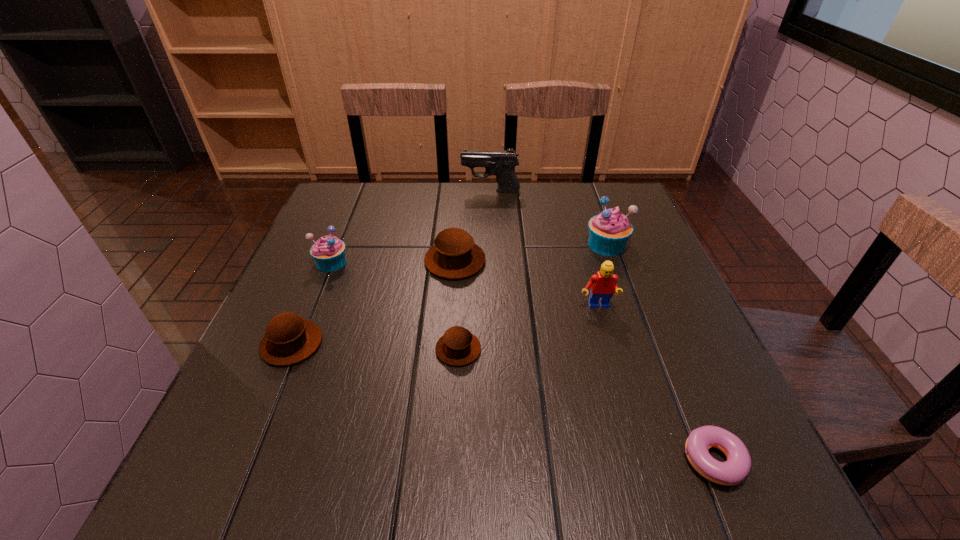
You are a GUI agent. You are given a task and a screenshot of the screen. Output one action in this format:
    pyautogui.click(x=<x>, y=<y>)
    Task: Click on the smallest brown muffin
    
    Given the screenshot: What is the action you would take?
    pyautogui.click(x=458, y=346)

Locate an element on the screen. The width and height of the screenshot is (960, 540). the shortest muffin is located at coordinates (458, 346).

At what (x,y) coordinates should I click in order to perform the action: click on doughnut. Please return your answer as a coordinate pair (x, y). Looking at the image, I should click on (731, 472).

The image size is (960, 540). I want to click on the shortest object, so click(731, 472).

Locate an element on the screen. free space located 0.240m at the barrel of the black pistol is located at coordinates (382, 191).

Where is `free space located 0.250m at the barrel of the black pistol`? The width and height of the screenshot is (960, 540). free space located 0.250m at the barrel of the black pistol is located at coordinates (379, 191).

Where is `free space located 0.250m at the barrel of the black pistol`? The height and width of the screenshot is (540, 960). free space located 0.250m at the barrel of the black pistol is located at coordinates (379, 191).

The image size is (960, 540). What are the coordinates of `vacant space located 0.110m on the left of the right blue muffin` in the screenshot? It's located at (542, 245).

The width and height of the screenshot is (960, 540). What are the coordinates of `free space located 0.270m on the front-facing side of the Lego` in the screenshot? It's located at (631, 428).

You are a GUI agent. You are given a task and a screenshot of the screen. Output one action in this format:
    pyautogui.click(x=<x>, y=<y>)
    Task: Click on the free space located on the front of the smaller blue muffin
    
    Given the screenshot: What is the action you would take?
    pyautogui.click(x=287, y=374)